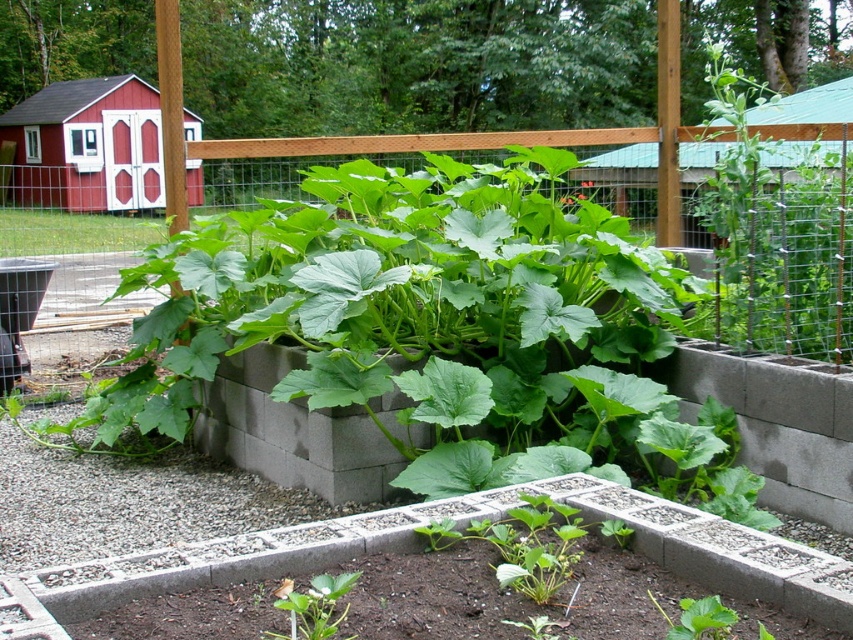
Question: Is wooden fence at upper center closer to the viewer compared to green leafy plant at center?

Choices:
 (A) no
 (B) yes

Answer: (A)

Question: Can you confirm if wooden fence at upper center is thinner than green leafy plant at center?

Choices:
 (A) no
 (B) yes

Answer: (A)

Question: Which point is closer to the camera?

Choices:
 (A) wooden fence at upper center
 (B) green leafy plant at center

Answer: (B)

Question: Does wooden fence at upper center come in front of green leafy plant at center?

Choices:
 (A) yes
 (B) no

Answer: (B)

Question: Which point appears farthest from the camera in this image?

Choices:
 (A) (318, 620)
 (B) (778, 177)

Answer: (B)